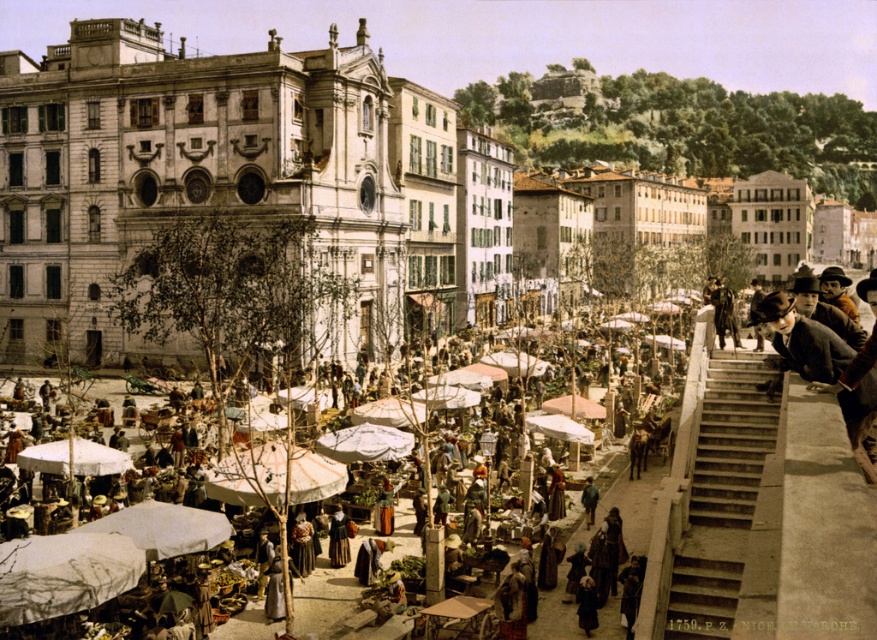
You are a delivery person carrying a heavy package and need to reach the dark brown fur coat at upper right. You see the gray concrete stairs at right. Can you use the stairs to get closer to the coat?

The gray concrete stairs at right and dark brown fur coat at upper right are 14.97 meters apart from each other. Since the stairs are near the right side of the scene and the coat is at the upper right, using the stairs might help you ascend to a higher level, potentially getting closer to the coat. However, the exact distance and path aren

You are a vendor at the market and want to place your dark brown fur coat at upper right under the white fabric umbrella at lower left for shade. Is the umbrella wide enough to cover the coat?

The white fabric umbrella at lower left might be wider than dark brown fur coat at upper right, so it could potentially provide enough coverage. However, since the exact dimensions aren not specified, there is uncertainty in the answer.

You are a delivery person carrying a large package that requires a clear path to navigate through the market. You see the white fabric umbrella at lower left and the dark brown fur coat at upper right. Can you safely pass between them without needing to adjust your path?

The white fabric umbrella at lower left and dark brown fur coat at upper right are 20.01 meters apart from each other, so there is enough space for the delivery person to pass safely between them without needing to adjust their path.